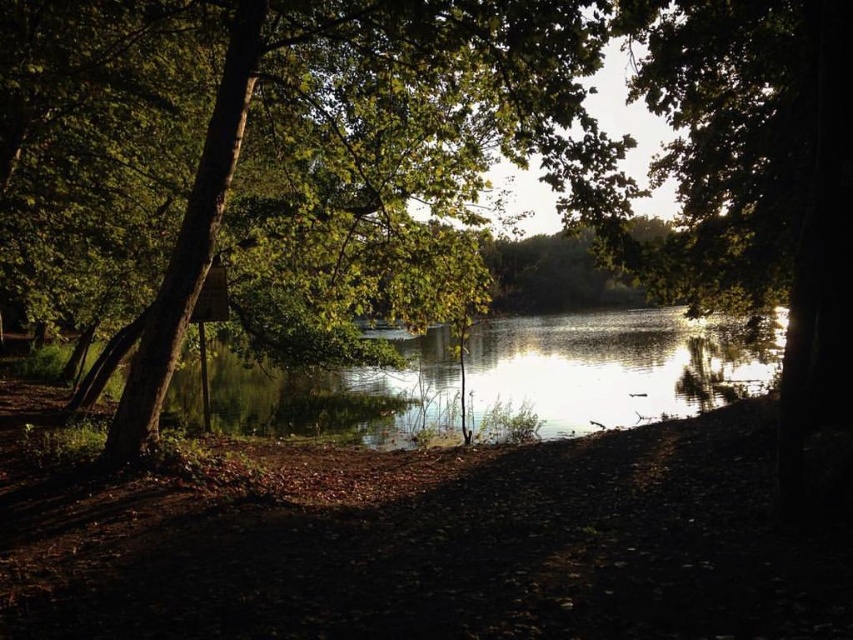
You are standing at the edge of the lake and want to take a photo of the green leafy tree at center. If your camera has a maximum zoom range of 10 meters, will you be able to capture the tree clearly without moving closer?

The green leafy tree at center is 8.45 meters away from camera. Since the camera can zoom up to 10 meters, you can capture the tree clearly without moving closer.

You are standing at the edge of the lake and see the point marked at coordinates (265,134). What object is located at that point?

The point at coordinates (265,134) corresponds to the green leafy tree at center.

You are standing at the edge of the lake and see two points in the scene. The first point is at coordinates point (175, 314) and the second is at point (496, 321). Which point is closer to you?

Point (175, 314) is in front of point (496, 321), so the first point is closer to you.